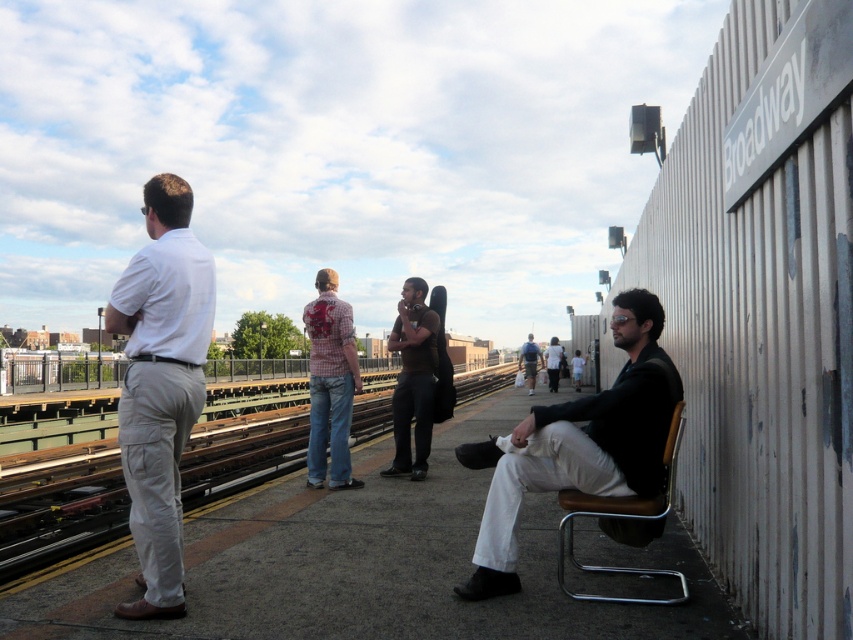
You are a photographer trying to capture a candid shot of the white cotton shirt at center without the brown matte guitar case at center blocking the view. Based on their sizes, do you think you can position yourself in a way to avoid the case blocking the shirt?

The brown matte guitar case at center occupies less space than the white cotton shirt at center, so it might still block part of the shirt depending on their exact positions. You may need to adjust your angle to ensure the smaller case doesn not obscure the larger shirt.